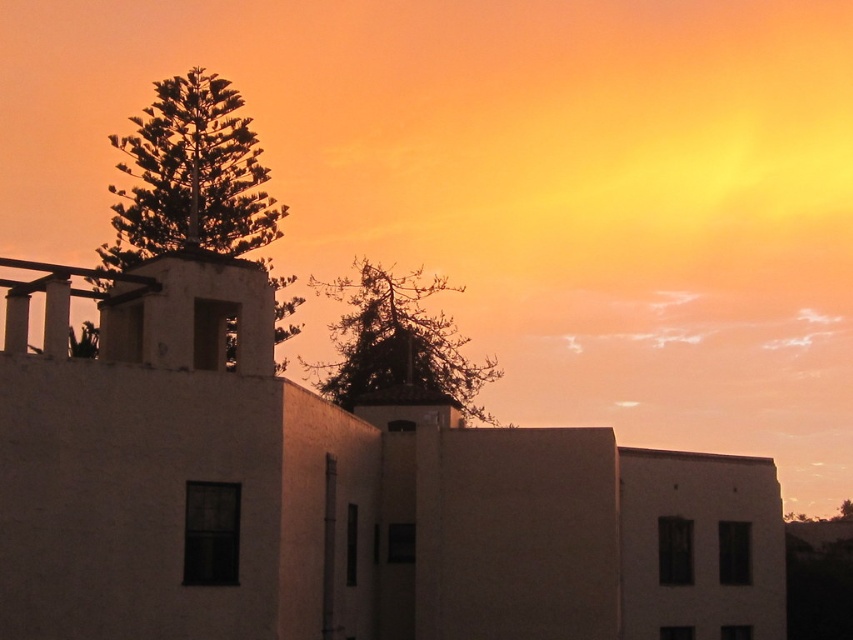
Does green leafy tree at upper left lie behind silvery metallic tree at upper center?

No, it is in front of silvery metallic tree at upper center.

Consider the image. Who is positioned more to the right, green leafy tree at upper left or silvery metallic tree at upper center?

Positioned to the right is silvery metallic tree at upper center.

Is point (123, 147) positioned behind point (438, 394)?

Yes, it is.

What are the coordinates of `green leafy tree at upper left` in the screenshot? It's located at (190, 177).